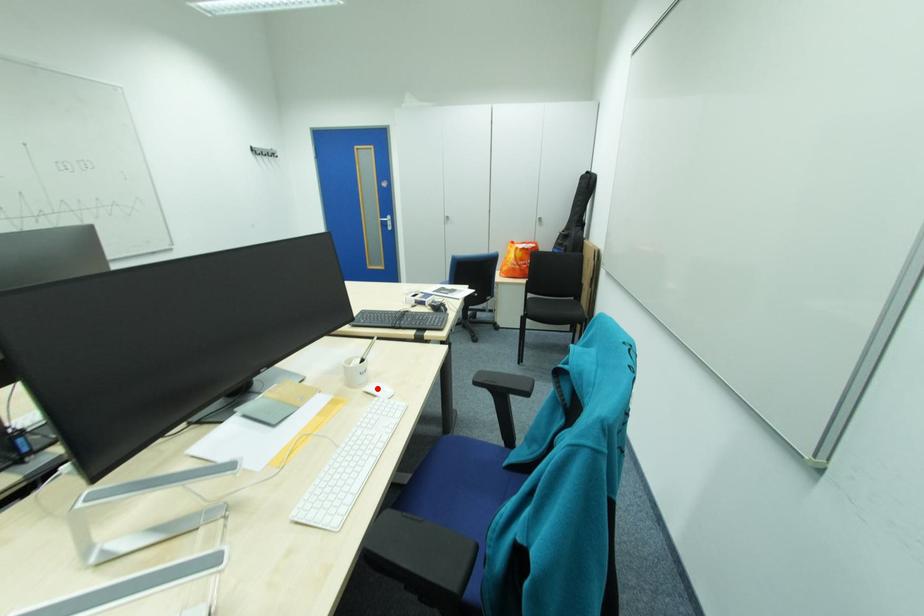
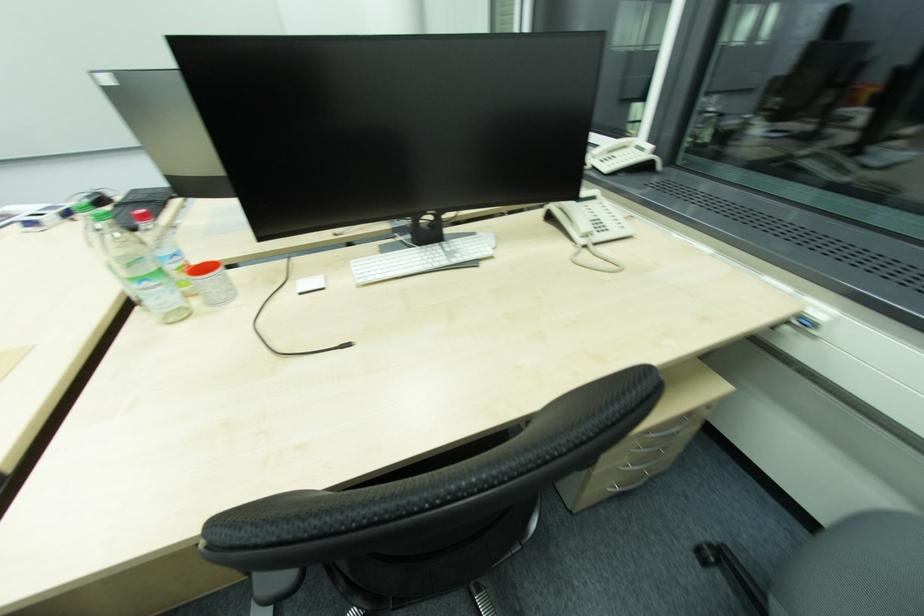
Question: I am providing you with two images of the same scene from different viewpoints. A red point is marked on the first image. At the location where the point appears in image 1, is it still visible in image 2?

Choices:
 (A) Yes
 (B) No

Answer: (B)